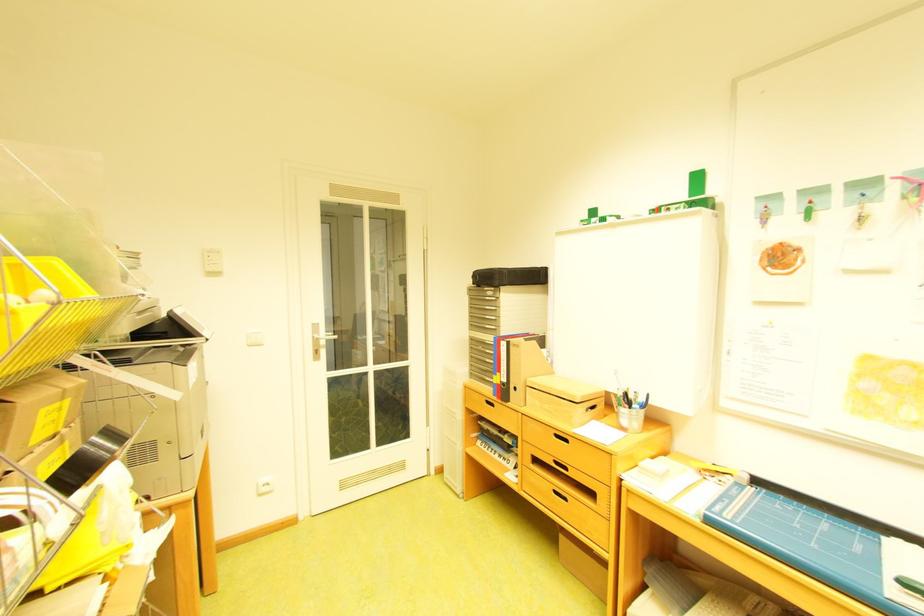
Where would you pull the silver door handle? Please return your answer as a coordinate pair (x, y).

(323, 336)